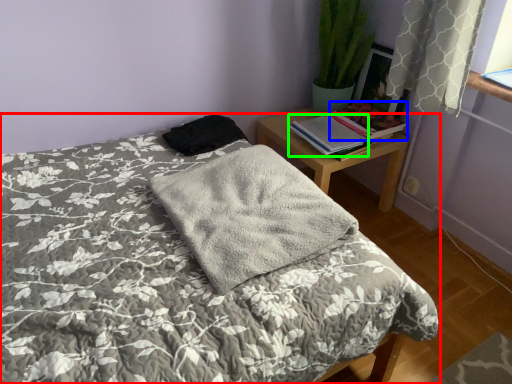
Question: Considering the real-world distances, which object is closest to bed (highlighted by a red box)? book (highlighted by a blue box) or book (highlighted by a green box).

Choices:
 (A) book
 (B) book

Answer: (B)